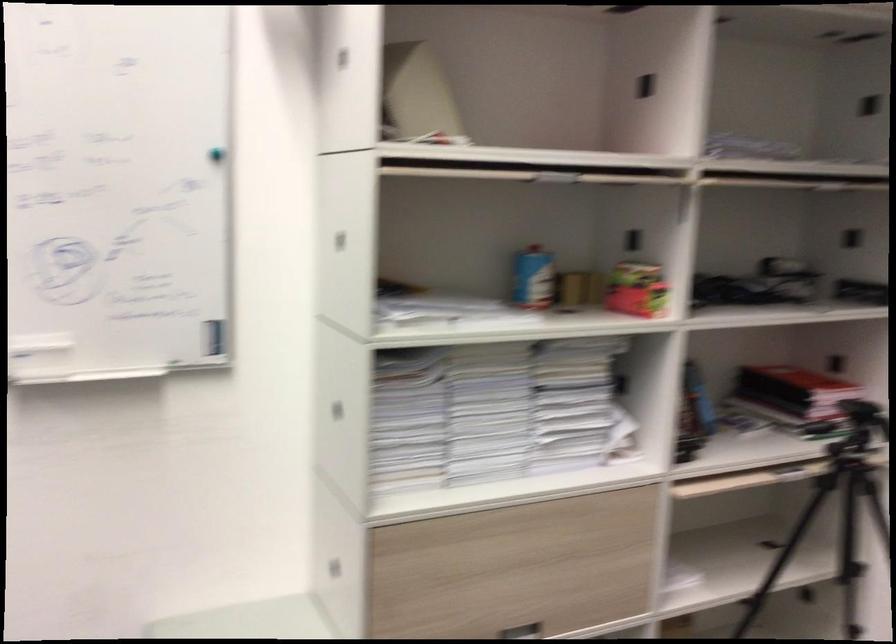
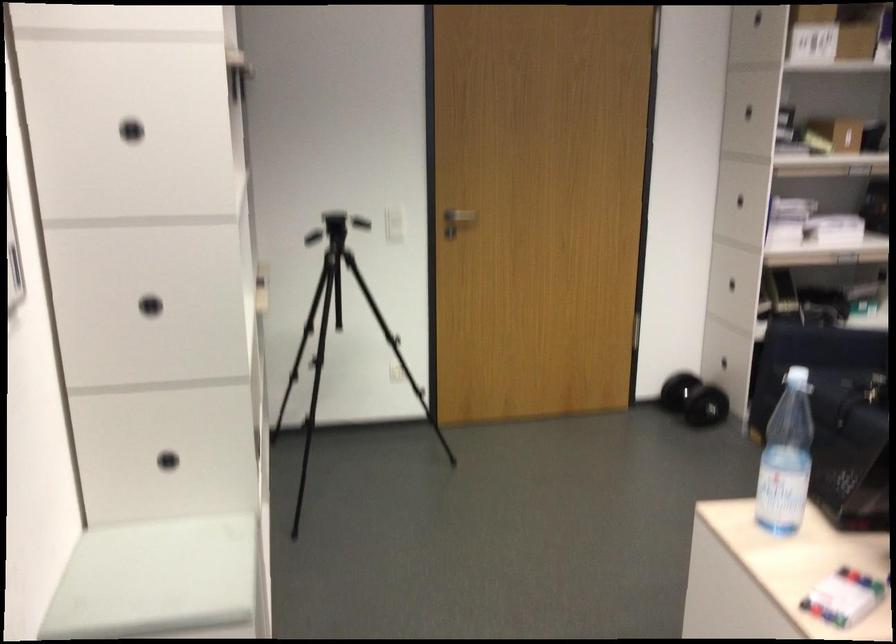
Question: I am providing you with two images of the same scene from different viewpoints. Which of the following objects are not visible in image2?

Choices:
 (A) plastic water bottle
 (B) green and red shoe
 (C) stack of paper
 (D) white light switch

Answer: (C)